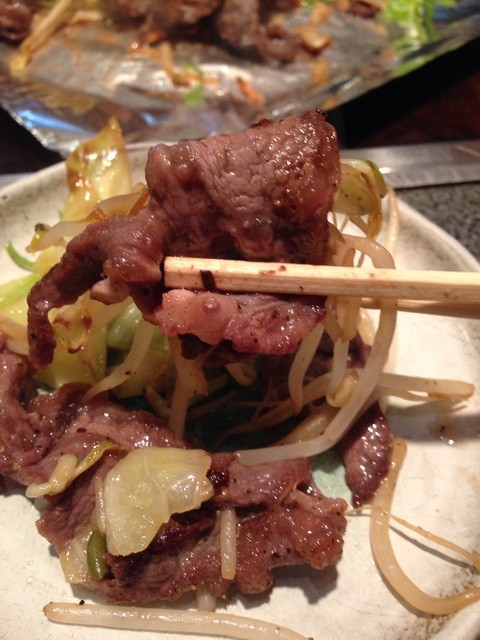
You are a GUI agent. You are given a task and a screenshot of the screen. Output one action in this format:
    pyautogui.click(x=<x>, y=<y>)
    Task: Click on the table
    This screenshot has width=480, height=640.
    Given the screenshot: What is the action you would take?
    pyautogui.click(x=440, y=205)